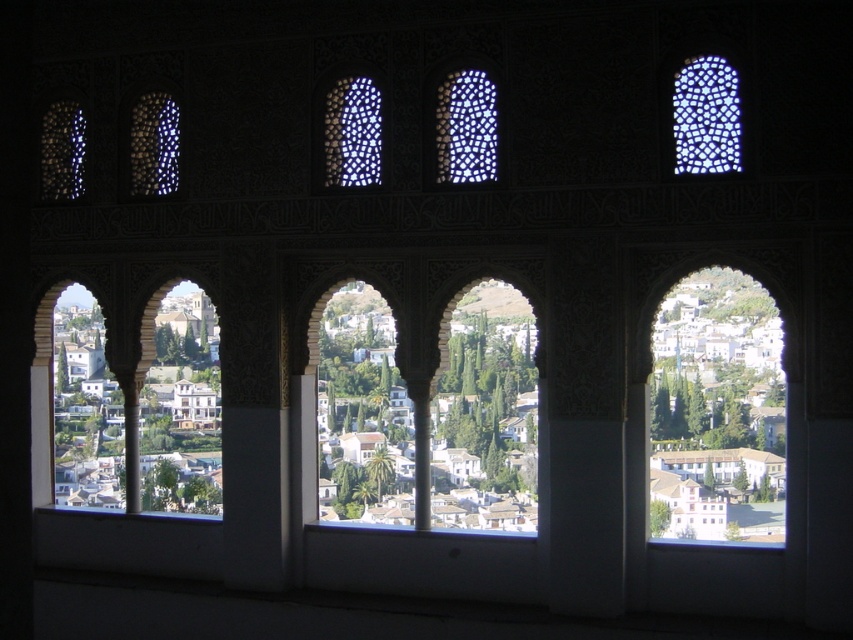
Can you confirm if white mosaic tile at center is positioned to the right of translucent mosaic tile at center?

Correct, you'll find white mosaic tile at center to the right of translucent mosaic tile at center.

The height and width of the screenshot is (640, 853). Describe the element at coordinates (466, 128) in the screenshot. I see `white mosaic tile at center` at that location.

Which is behind, point (474, 161) or point (346, 170)?

Point (346, 170)

You are a GUI agent. You are given a task and a screenshot of the screen. Output one action in this format:
    pyautogui.click(x=<x>, y=<y>)
    Task: Click on the white mosaic tile at center
    The width and height of the screenshot is (853, 640).
    Given the screenshot: What is the action you would take?
    pyautogui.click(x=466, y=128)

Describe the element at coordinates (706, 116) in the screenshot. I see `translucent mosaic at upper right` at that location.

Is translucent mosaic at upper right thinner than translucent mosaic tile at center?

No, translucent mosaic at upper right is not thinner than translucent mosaic tile at center.

Is point (712, 152) positioned after point (326, 122)?

That is False.

Identify the location of translucent mosaic at upper right. (706, 116).

Can you confirm if translucent mosaic at upper right is taller than white mosaic tile at center?

No.

Measure the distance between translucent mosaic at upper right and white mosaic tile at center.

6.51 meters

Identify the location of translucent mosaic at upper right. (706, 116).